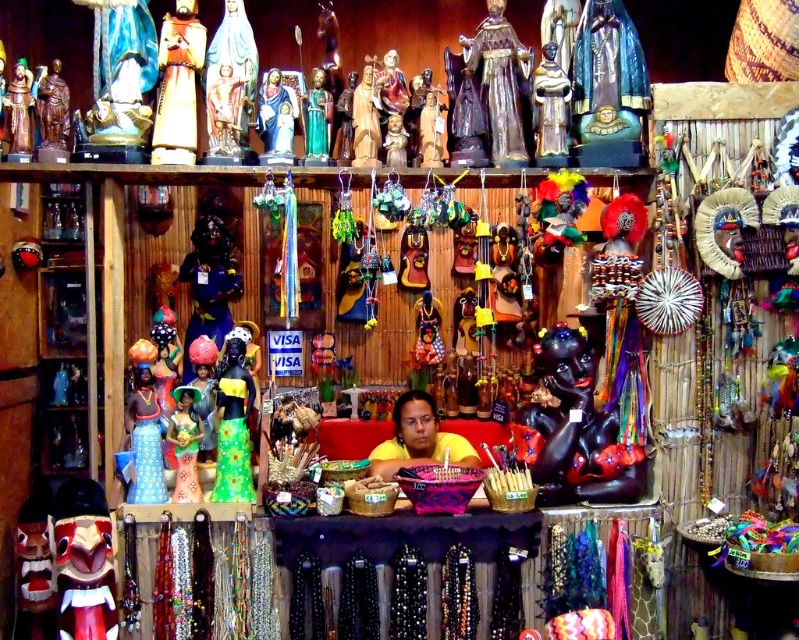
Who is positioned more to the right, shiny green fabric doll at center or matte blue fabric doll at left?

shiny green fabric doll at center

Can you confirm if shiny green fabric doll at center is positioned above matte blue fabric doll at left?

Yes, shiny green fabric doll at center is above matte blue fabric doll at left.

Find the location of a particular element. Image resolution: width=799 pixels, height=640 pixels. shiny green fabric doll at center is located at coordinates 233,422.

Find the location of a particular element. shiny green fabric doll at center is located at coordinates (233, 422).

Does point (396, 419) lie in front of point (185, 401)?

No.

Does yellow matte shirt at center have a lesser height compared to matte green fabric doll at center?

Yes, yellow matte shirt at center is shorter than matte green fabric doll at center.

What are the coordinates of `yellow matte shirt at center` in the screenshot? It's located at (418, 438).

Which is above, multicolored beaded necklaces at center or matte blue fabric doll at left?

matte blue fabric doll at left is higher up.

Between point (263, 538) and point (137, 384), which one is positioned in front?

Positioned in front is point (263, 538).

Is point (269, 563) positioned in front of point (146, 397)?

Yes, point (269, 563) is closer to viewer.

Identify the location of multicolored beaded necklaces at center. Image resolution: width=799 pixels, height=640 pixels. (213, 566).